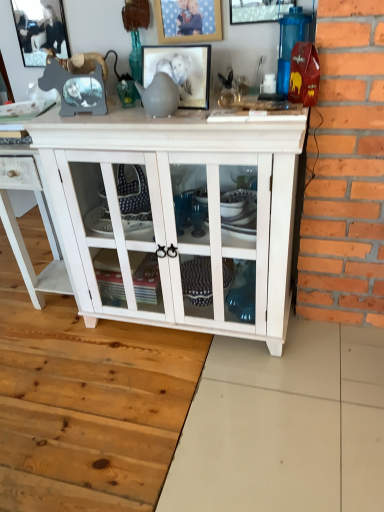
Question: Is white wood cupboard at center outside of white wood cabinet at center?

Choices:
 (A) no
 (B) yes

Answer: (B)

Question: Does white wood cupboard at center come in front of white wood cabinet at center?

Choices:
 (A) no
 (B) yes

Answer: (B)

Question: Is white wood cabinet at center at the back of white wood cupboard at center?

Choices:
 (A) yes
 (B) no

Answer: (B)

Question: From a real-world perspective, does white wood cupboard at center sit lower than white wood cabinet at center?

Choices:
 (A) no
 (B) yes

Answer: (A)

Question: Is white wood cupboard at center facing towards white wood cabinet at center?

Choices:
 (A) no
 (B) yes

Answer: (A)

Question: Can you confirm if white wood cupboard at center is bigger than white wood cabinet at center?

Choices:
 (A) no
 (B) yes

Answer: (B)

Question: Is metallic silver picture frame at upper center, the first picture frame in the right-to-left sequence, turned away from white wood cabinet at center?

Choices:
 (A) yes
 (B) no

Answer: (B)

Question: Considering the relative sizes of metallic silver picture frame at upper center, the first picture frame in the right-to-left sequence, and white wood cabinet at center in the image provided, is metallic silver picture frame at upper center, the first picture frame in the right-to-left sequence, shorter than white wood cabinet at center?

Choices:
 (A) yes
 (B) no

Answer: (A)

Question: Is the depth of metallic silver picture frame at upper center, the first picture frame in the right-to-left sequence, greater than that of white wood cabinet at center?

Choices:
 (A) no
 (B) yes

Answer: (A)

Question: Is metallic silver picture frame at upper center, the first picture frame in the right-to-left sequence, bigger than white wood cabinet at center?

Choices:
 (A) no
 (B) yes

Answer: (A)

Question: Is metallic silver picture frame at upper center, which is the 4th picture frame from left to right, at the right side of white wood cabinet at center?

Choices:
 (A) no
 (B) yes

Answer: (B)

Question: From a real-world perspective, does metallic silver picture frame at upper center, which is the 4th picture frame from left to right, sit lower than white wood cabinet at center?

Choices:
 (A) yes
 (B) no

Answer: (B)

Question: Is wooden picture frame at upper center, placed as the 3th picture frame when sorted from left to right, not near white wood cupboard at center?

Choices:
 (A) no
 (B) yes

Answer: (A)